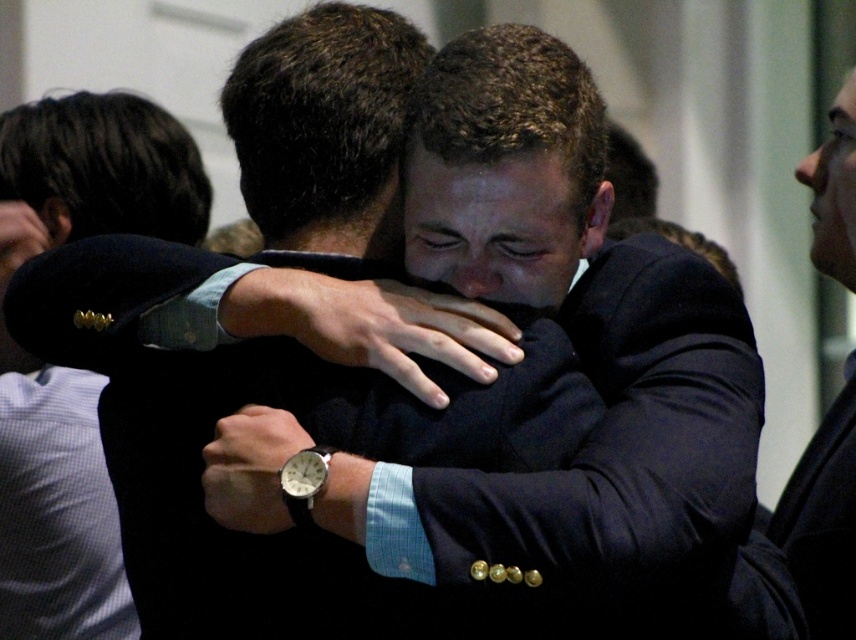
You are a photographer observing the scene. You notice the black fabric arm at center and the dark blue suit at right. Which object is positioned higher in the image?

The black fabric arm at center is located above the dark blue suit at right, so it is positioned higher in the image.